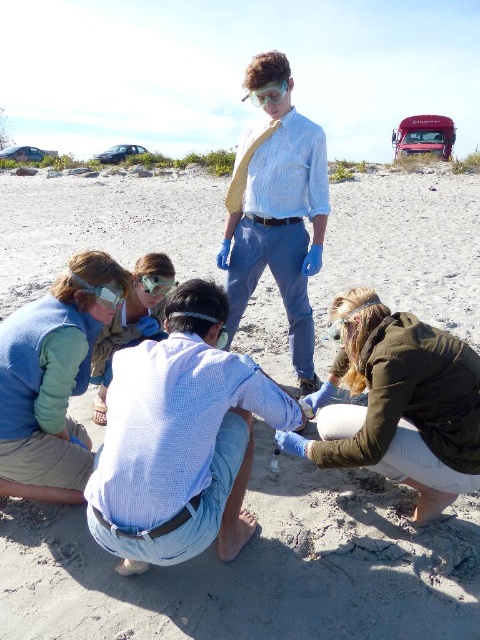
Question: Can you confirm if blue checkered shirt at center is positioned below green fuzzy jacket at lower right?

Choices:
 (A) yes
 (B) no

Answer: (A)

Question: Does matte blue shirt at lower left appear over clear plastic goggles at center?

Choices:
 (A) no
 (B) yes

Answer: (A)

Question: Which point is closer to the camera?

Choices:
 (A) green fuzzy jacket at lower right
 (B) matte blue shirt at lower left
 (C) blue checkered shirt at center
 (D) green fleece vest at lower left

Answer: (C)

Question: Among these objects, which one is nearest to the camera?

Choices:
 (A) blue checkered shirt at center
 (B) smooth sand at center
 (C) clear plastic goggles at center
 (D) green fleece vest at lower left

Answer: (A)

Question: Among these points, which one is nearest to the camera?

Choices:
 (A) (34, 177)
 (B) (160, 280)
 (C) (4, 458)

Answer: (C)

Question: Is blue checkered shirt at center positioned at the back of green fuzzy jacket at lower right?

Choices:
 (A) yes
 (B) no

Answer: (B)